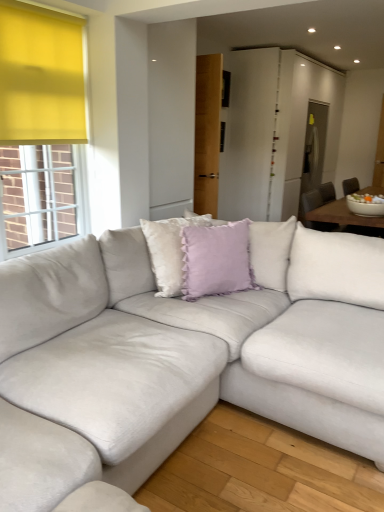
Question: Does suede white couch at center have a lesser height compared to lavender velvet cushion at center, the 2th pillow from the left?

Choices:
 (A) yes
 (B) no

Answer: (B)

Question: Is suede white couch at center not close to lavender velvet cushion at center, acting as the first pillow starting from the right?

Choices:
 (A) yes
 (B) no

Answer: (B)

Question: Does suede white couch at center have a lesser width compared to lavender velvet cushion at center, the 2th pillow from the left?

Choices:
 (A) no
 (B) yes

Answer: (A)

Question: Is suede white couch at center behind lavender velvet cushion at center, acting as the first pillow starting from the right?

Choices:
 (A) yes
 (B) no

Answer: (B)

Question: Can you confirm if suede white couch at center is positioned to the right of lavender velvet cushion at center, the 2th pillow from the left?

Choices:
 (A) yes
 (B) no

Answer: (B)

Question: From the image's perspective, is lavender velvet cushion at center, acting as the first pillow starting from the right, positioned above or below lavender velvet pillow at center, the 1th pillow from the left?

Choices:
 (A) below
 (B) above

Answer: (A)

Question: Considering the positions of point (203, 290) and point (175, 243), is point (203, 290) closer or farther from the camera than point (175, 243)?

Choices:
 (A) closer
 (B) farther

Answer: (A)

Question: From a real-world perspective, relative to lavender velvet pillow at center, the second pillow when ordered from right to left, is lavender velvet cushion at center, the 2th pillow from the left, vertically above or below?

Choices:
 (A) below
 (B) above

Answer: (B)

Question: Is lavender velvet cushion at center, acting as the first pillow starting from the right, in front of or behind lavender velvet pillow at center, the second pillow when ordered from right to left, in the image?

Choices:
 (A) front
 (B) behind

Answer: (B)

Question: From a real-world perspective, is lavender velvet pillow at center, the 1th pillow from the left, positioned above or below lavender velvet cushion at center, the 2th pillow from the left?

Choices:
 (A) above
 (B) below

Answer: (B)

Question: In the image, is lavender velvet pillow at center, the 1th pillow from the left, on the left side or the right side of lavender velvet cushion at center, the 2th pillow from the left?

Choices:
 (A) left
 (B) right

Answer: (A)

Question: Looking at the image, does lavender velvet pillow at center, the second pillow when ordered from right to left, seem bigger or smaller compared to lavender velvet cushion at center, acting as the first pillow starting from the right?

Choices:
 (A) small
 (B) big

Answer: (B)

Question: Is lavender velvet pillow at center, the second pillow when ordered from right to left, taller or shorter than lavender velvet cushion at center, acting as the first pillow starting from the right?

Choices:
 (A) short
 (B) tall

Answer: (B)

Question: Based on their positions, is suede white couch at center located to the left or right of lavender velvet cushion at center, acting as the first pillow starting from the right?

Choices:
 (A) left
 (B) right

Answer: (A)

Question: From a real-world perspective, is suede white couch at center physically located above or below lavender velvet cushion at center, the 2th pillow from the left?

Choices:
 (A) below
 (B) above

Answer: (A)